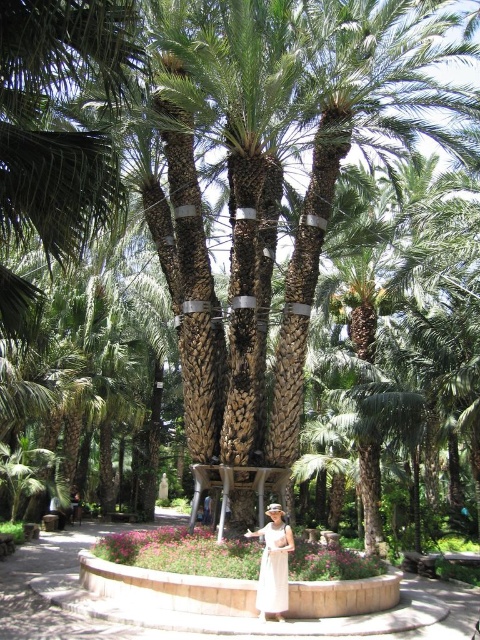
In order to click on light beige fabric dress at center in this screenshot , I will do `click(274, 564)`.

Is light beige fabric dress at center below white satin dress at center?

Indeed, light beige fabric dress at center is positioned under white satin dress at center.

This screenshot has width=480, height=640. Describe the element at coordinates (274, 564) in the screenshot. I see `light beige fabric dress at center` at that location.

Locate an element on the screen. The image size is (480, 640). light beige fabric dress at center is located at coordinates (274, 564).